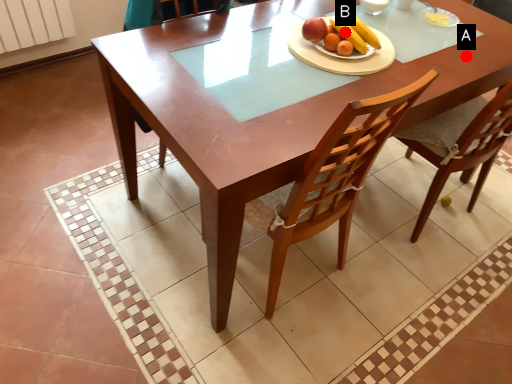
Question: Two points are circled on the image, labeled by A and B beside each circle. Which point is closer to the camera?

Choices:
 (A) A is closer
 (B) B is closer

Answer: (B)